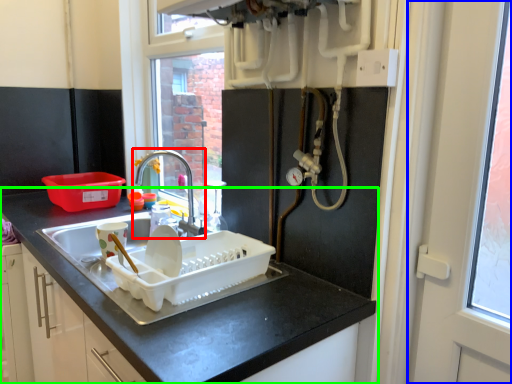
Question: Based on their relative distances, which object is farther from tap (highlighted by a red box)? Choose from screen door (highlighted by a blue box) and countertop (highlighted by a green box).

Choices:
 (A) screen door
 (B) countertop

Answer: (A)